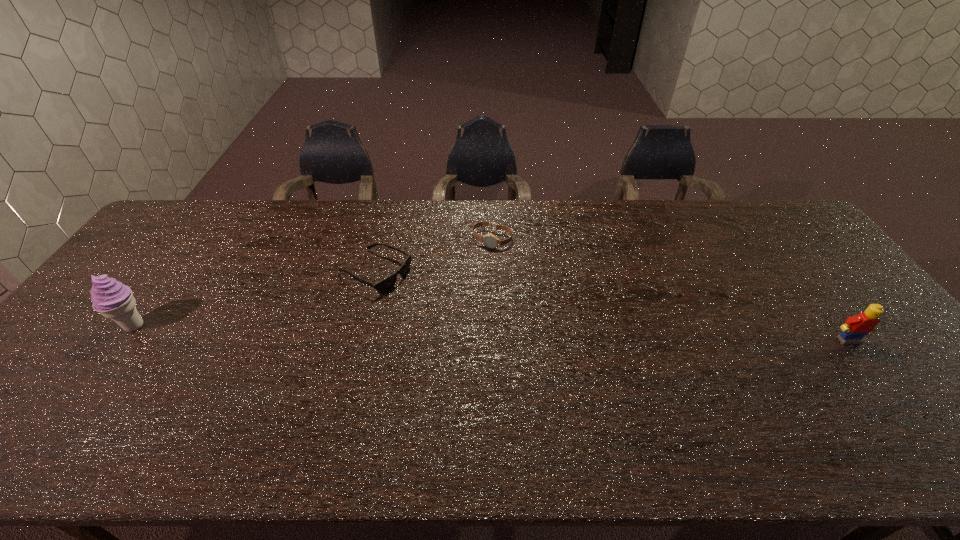
What are the coordinates of `vacant area at the far left corner of the desktop` in the screenshot? It's located at (156, 241).

What are the coordinates of `empty space between the icecream and the sunglasses` in the screenshot? It's located at (255, 299).

In order to click on free space between the Lego and the watch in this screenshot , I will do `click(670, 290)`.

Where is `blank region between the rightmost object and the watch`? blank region between the rightmost object and the watch is located at coordinates (670, 290).

The height and width of the screenshot is (540, 960). What are the coordinates of `vacant space in between the third object from left to right and the Lego` in the screenshot? It's located at (670, 290).

In order to click on vacant point located between the watch and the third object from right to left in this screenshot , I will do `click(434, 256)`.

Find the location of a particular element. The width and height of the screenshot is (960, 540). free space between the icecream and the rightmost object is located at coordinates (492, 333).

Where is `blank region between the Lego and the watch`? This screenshot has width=960, height=540. blank region between the Lego and the watch is located at coordinates (670, 290).

The height and width of the screenshot is (540, 960). In order to click on free spot between the second tallest object and the leftmost object in this screenshot , I will do `click(492, 333)`.

This screenshot has height=540, width=960. What are the coordinates of `empty space that is in between the third object from right to left and the leftmost object` in the screenshot? It's located at (255, 299).